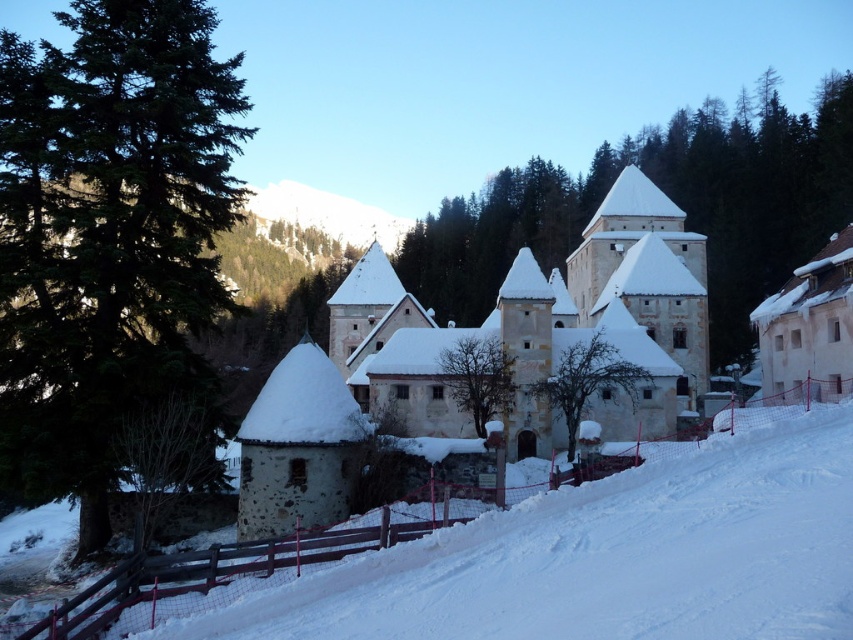
Question: Estimate the real-world distances between objects in this image. Which object is closer to the green coniferous tree at left?

Choices:
 (A) snowy bare tree at center
 (B) bare branches at center
 (C) white snow at lower right

Answer: (B)

Question: Which of the following is the closest to the observer?

Choices:
 (A) bare branches at center
 (B) white snow at lower right
 (C) snowy bare tree at center

Answer: (B)

Question: Does green coniferous tree at left lie behind white snow at lower right?

Choices:
 (A) yes
 (B) no

Answer: (A)

Question: Is white snow at lower right above snowy bare tree at center?

Choices:
 (A) no
 (B) yes

Answer: (A)

Question: Does green coniferous tree at left come in front of snowy bare tree at center?

Choices:
 (A) no
 (B) yes

Answer: (B)

Question: Considering the real-world distances, which object is closest to the snowy bare tree at center?

Choices:
 (A) bare branches at center
 (B) white snow at lower right
 (C) green coniferous tree at left

Answer: (A)